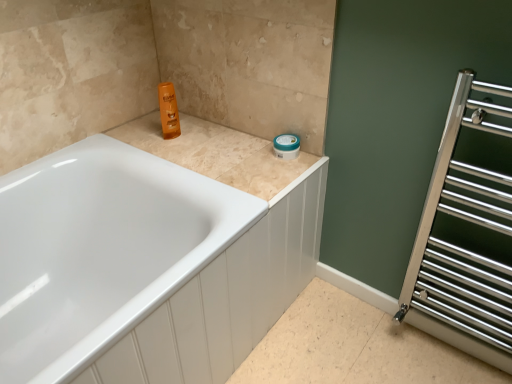
Question: Is beige tile counter top at upper center to the left or to the right of polished chrome towel rack at right in the image?

Choices:
 (A) right
 (B) left

Answer: (B)

Question: Would you say beige tile counter top at upper center is inside or outside polished chrome towel rack at right?

Choices:
 (A) inside
 (B) outside

Answer: (B)

Question: Which of these objects is positioned farthest from the polished chrome towel rack at right?

Choices:
 (A) beige tile counter top at upper center
 (B) white glossy bathtub at upper left

Answer: (B)

Question: Which object is the closest to the white glossy bathtub at upper left?

Choices:
 (A) beige tile counter top at upper center
 (B) polished chrome towel rack at right

Answer: (A)